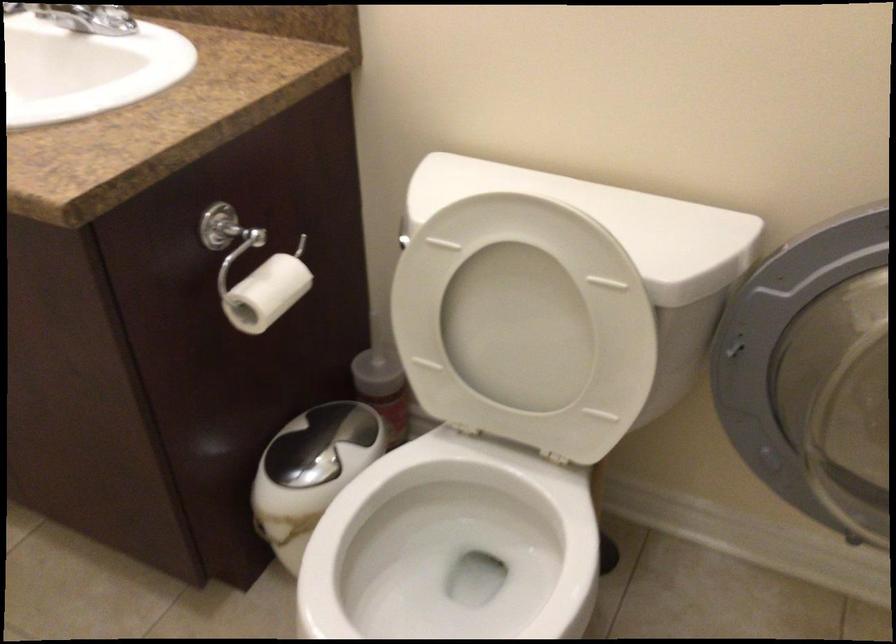
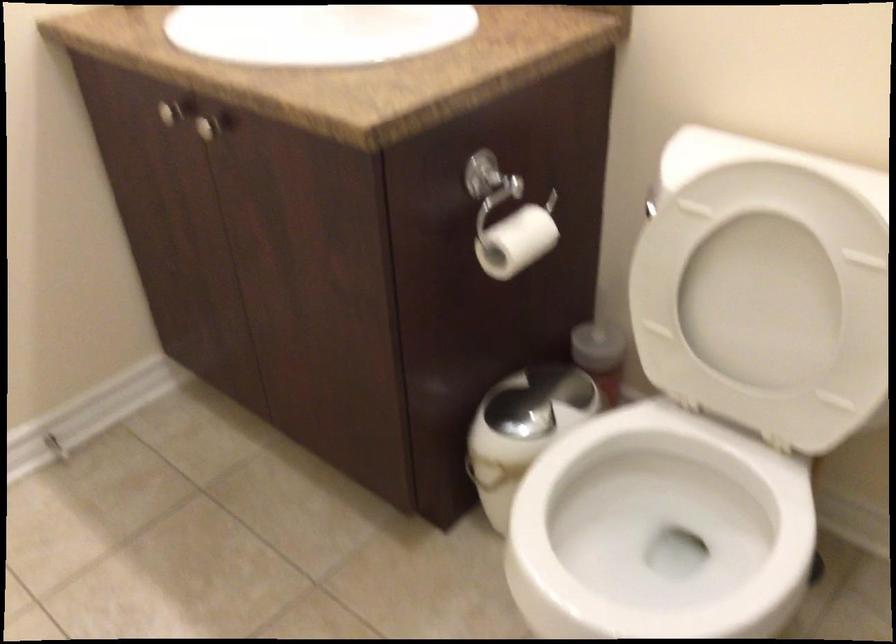
The images are taken continuously from a first-person perspective. In which direction are you moving?

The cameraman moved toward left, backward.